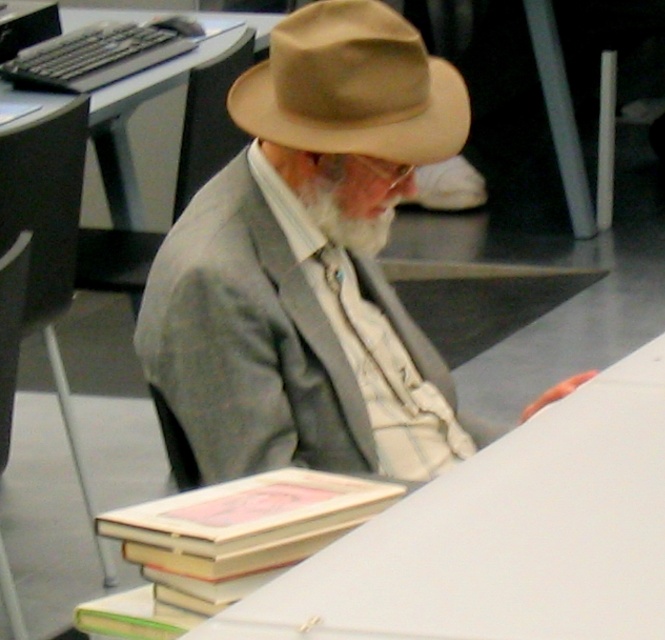
Question: Among these objects, which one is nearest to the camera?

Choices:
 (A) hardcover book at lower center
 (B) tan felt fedora at center
 (C) light brown felt hat at center

Answer: (A)

Question: Can you confirm if light brown felt hat at center is positioned below tan felt fedora at center?

Choices:
 (A) no
 (B) yes

Answer: (B)

Question: From the image, what is the correct spatial relationship of tan felt fedora at center in relation to white soft beard at center?

Choices:
 (A) below
 (B) above

Answer: (B)

Question: Which point is farther from the camera taking this photo?

Choices:
 (A) (225, 563)
 (B) (348, 240)

Answer: (B)

Question: Observing the image, what is the correct spatial positioning of light brown felt hat at center in reference to tan felt fedora at center?

Choices:
 (A) below
 (B) above

Answer: (A)

Question: Which point is farther to the camera?

Choices:
 (A) hardcover book at lower center
 (B) white soft beard at center
 (C) tan felt fedora at center
 (D) light brown felt hat at center

Answer: (B)